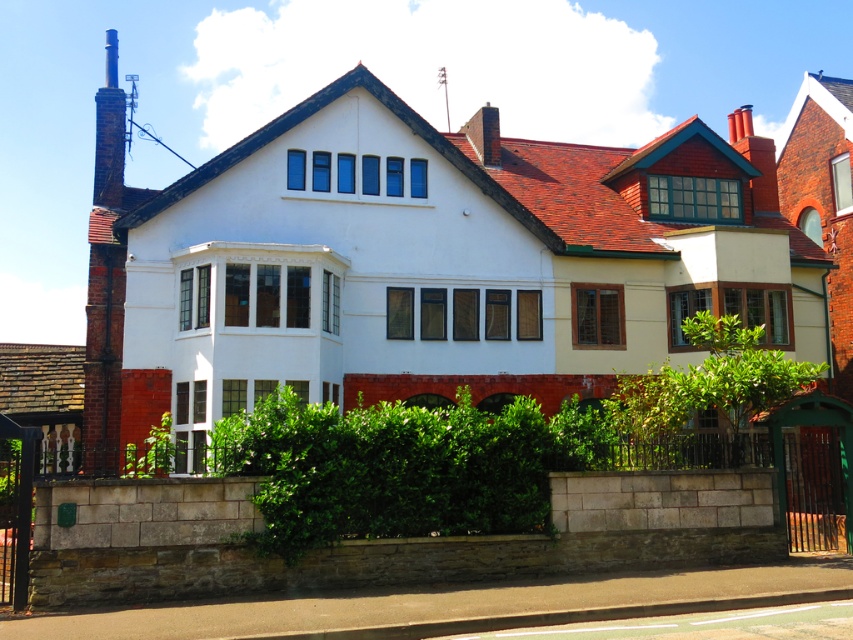
You are standing in front of the residential building and want to determine the relative positions of two points marked on the structure. Which of the two points, point [376,461] or point [114,372], is closer to you?

Point [376,461] is closer to the camera than point [114,372].

You are standing in front of the residential building and want to walk towards the green leafy hedge at center and the rusty brick chimney at left. Which object will you reach first?

You will reach the green leafy hedge at center first because it is closer to the viewer than the rusty brick chimney at left.